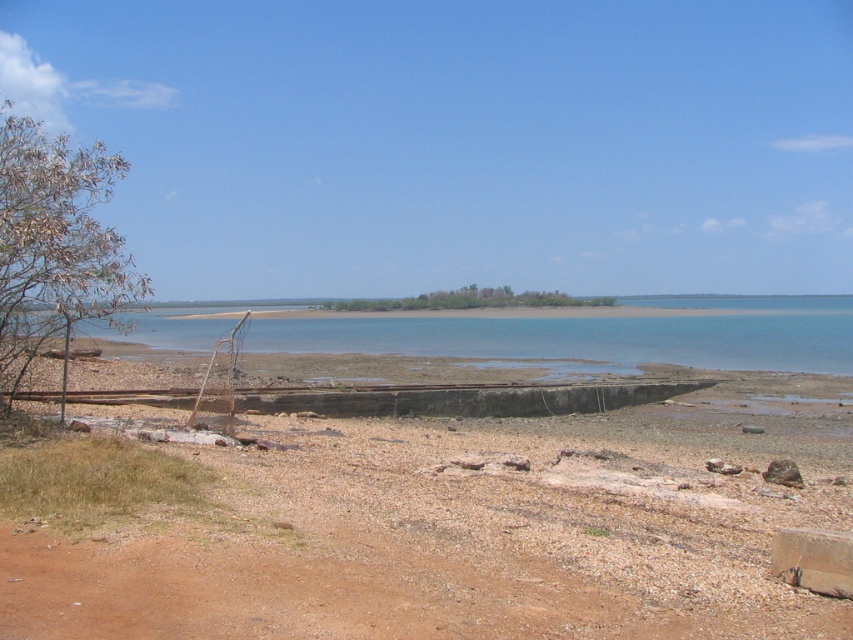
Does green leafy tree at left appear on the left side of green leafy trees at center?

Indeed, green leafy tree at left is positioned on the left side of green leafy trees at center.

Between green leafy tree at left and green leafy trees at center, which one is positioned lower?

Positioned lower is green leafy trees at center.

Where is `green leafy tree at left`? green leafy tree at left is located at coordinates (54, 243).

Can you confirm if blue water at center is taller than green leafy tree at left?

In fact, blue water at center may be shorter than green leafy tree at left.

Does blue water at center appear on the right side of green leafy tree at left?

Correct, you'll find blue water at center to the right of green leafy tree at left.

Does point (770, 353) come farther from viewer compared to point (0, 380)?

Yes, it is.

You are a GUI agent. You are given a task and a screenshot of the screen. Output one action in this format:
    pyautogui.click(x=<x>, y=<y>)
    Task: Click on the blue water at center
    The image size is (853, 640).
    Given the screenshot: What is the action you would take?
    pyautogui.click(x=595, y=333)

Can you confirm if brown gravelly sand at lower center is taller than green leafy tree at left?

Incorrect, brown gravelly sand at lower center's height is not larger of green leafy tree at left's.

Is point (264, 588) less distant than point (85, 260)?

That is True.

At what (x,y) coordinates should I click in order to perform the action: click on brown gravelly sand at lower center. Please return your answer as a coordinate pair (x, y). This screenshot has width=853, height=640. Looking at the image, I should click on (425, 548).